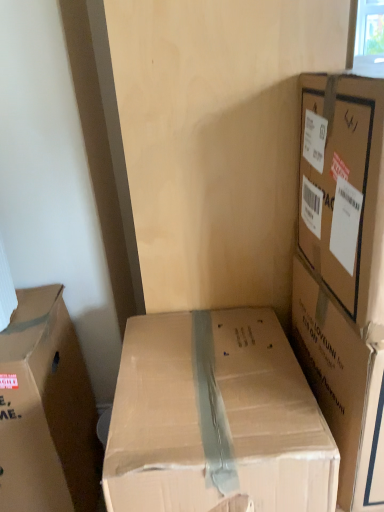
Question: Considering the positions of brown cardboard box at upper right, which ranks as the third box in left-to-right order, and brown cardboard box at left, which appears as the 1th box when viewed from the left, in the image, is brown cardboard box at upper right, which ranks as the third box in left-to-right order, wider or thinner than brown cardboard box at left, which appears as the 1th box when viewed from the left,?

Choices:
 (A) thin
 (B) wide

Answer: (A)

Question: From their relative heights in the image, would you say brown cardboard box at upper right, which ranks as the third box in left-to-right order, is taller or shorter than brown cardboard box at left, which appears as the 1th box when viewed from the left?

Choices:
 (A) short
 (B) tall

Answer: (A)

Question: Estimate the real-world distances between objects in this image. Which object is closer to the brown cardboard box at left, which appears as the 1th box when viewed from the left?

Choices:
 (A) brown cardboard box at upper right, which ranks as the third box in left-to-right order
 (B) brown cardboard box at center, the second box viewed from the right

Answer: (B)

Question: Which of these objects is positioned closest to the brown cardboard box at upper right, which ranks as the third box in left-to-right order?

Choices:
 (A) brown cardboard box at center, the second box viewed from the right
 (B) brown cardboard box at left, which appears as the 1th box when viewed from the left

Answer: (A)